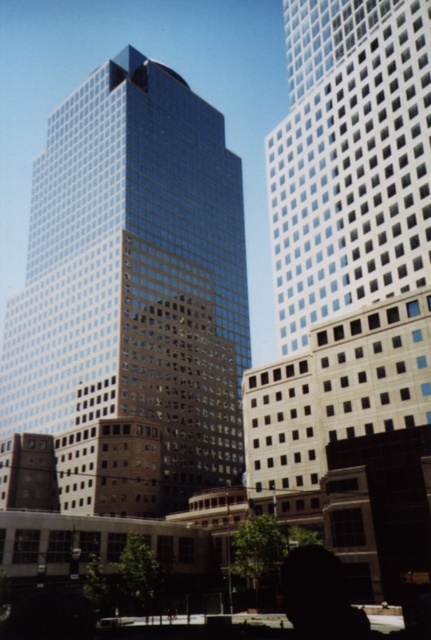
You are a city planner analyzing the urban layout. You need to determine which building has a greater horizontal spread. Based on the scene, which one is wider between the glassy reflective skyscraper at center and the white glass building at upper right?

The glassy reflective skyscraper at center has a greater width than the white glass building at upper right, so it is wider.

You are an architect standing in the city square. You see the glassy reflective skyscraper at center and the white glass building at upper right. Which building is positioned to the left when viewed from your perspective?

The glassy reflective skyscraper at center is positioned to the left of the white glass building at upper right from your perspective.

You are standing at the base of the tallest building on the left and want to look at the two points in the cityscape image. Which point, point (234, 232) or point (430, 38), is closer to you?

Point (430, 38) is closer to you because it is in front of point (234, 232).